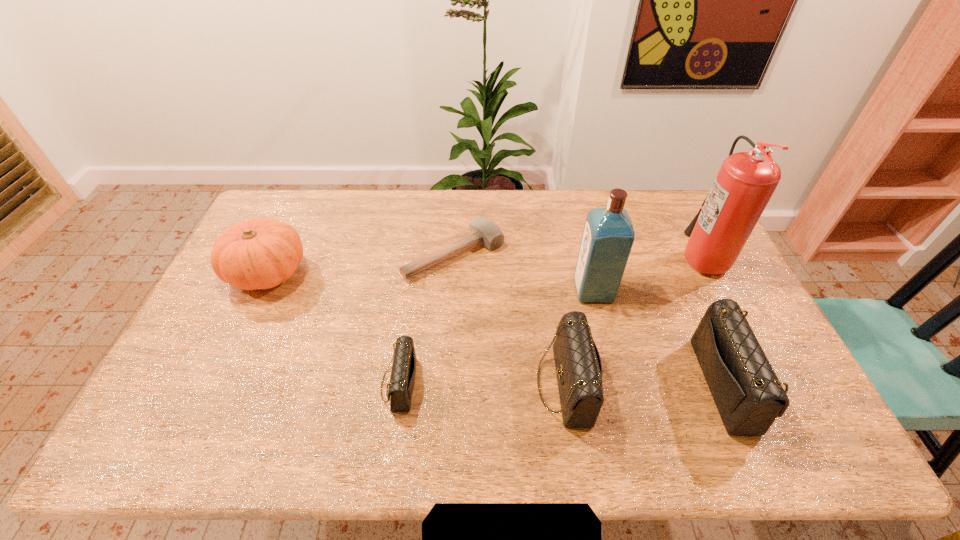
The width and height of the screenshot is (960, 540). I want to click on object positioned at the near right corner, so click(x=749, y=397).

At what (x,y) coordinates should I click in order to perform the action: click on vacant space at the far edge of the desktop. Please return your answer as a coordinate pair (x, y). This screenshot has height=540, width=960. Looking at the image, I should click on (413, 210).

What are the coordinates of `vacant space at the left edge of the desktop` in the screenshot? It's located at (227, 300).

What are the coordinates of `vacant area at the right edge` in the screenshot? It's located at (678, 255).

Locate an element on the screen. This screenshot has height=540, width=960. vacant space in between the shortest clutch bag and the mallet is located at coordinates coord(427,319).

This screenshot has width=960, height=540. Find the location of `blank region between the mallet and the fifth object from left to right`. blank region between the mallet and the fifth object from left to right is located at coordinates point(524,272).

This screenshot has height=540, width=960. I want to click on empty space between the mallet and the second shortest clutch bag, so click(510, 319).

The width and height of the screenshot is (960, 540). Find the location of `free space between the liquor and the leftmost object`. free space between the liquor and the leftmost object is located at coordinates (431, 281).

The image size is (960, 540). I want to click on vacant space that's between the second shortest object and the liquor, so click(496, 338).

The height and width of the screenshot is (540, 960). I want to click on unoccupied position between the shortest object and the rightmost clutch bag, so click(x=592, y=320).